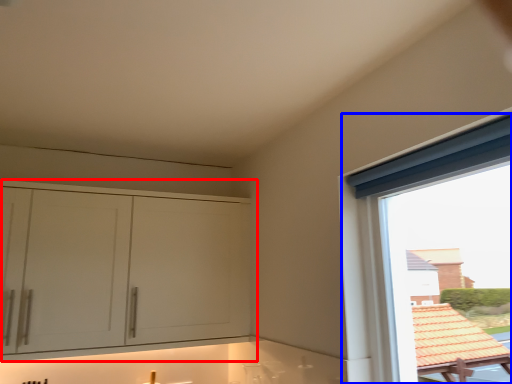
Question: Which point is closer to the camera, cabinetry (highlighted by a red box) or window (highlighted by a blue box)?

Choices:
 (A) cabinetry
 (B) window

Answer: (B)